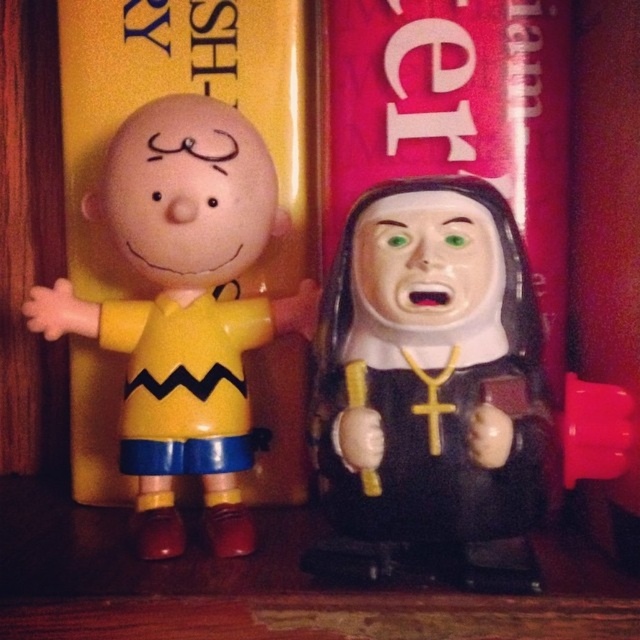
Between black matte nun at center and yellow matte plastic charlie brown figure at left, which one has less height?

Standing shorter between the two is black matte nun at center.

Does point (497, 417) come behind point (234, 417)?

That is False.

Measure the distance between black matte nun at center and camera.

black matte nun at center and camera are 64.23 centimeters apart.

Where is `black matte nun at center`? black matte nun at center is located at coordinates (429, 392).